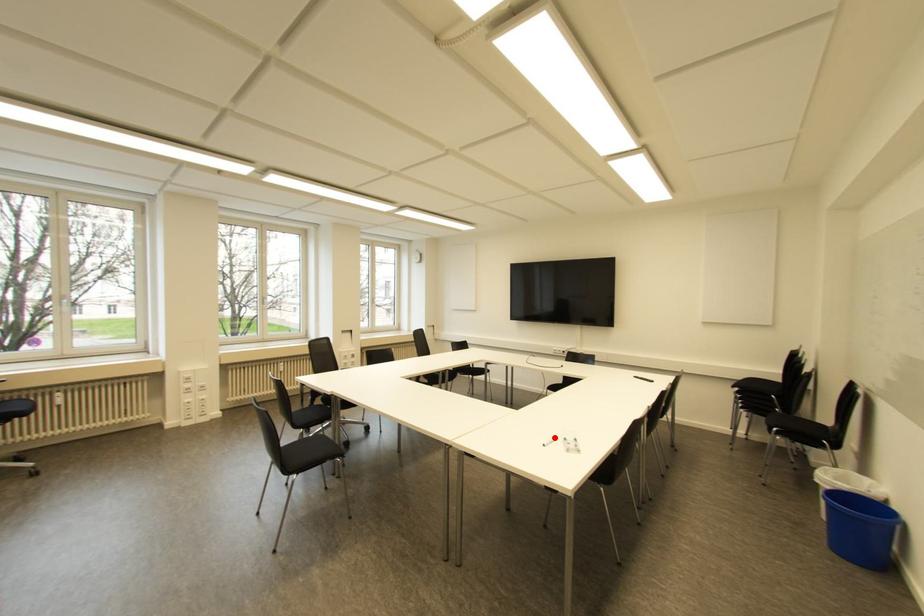
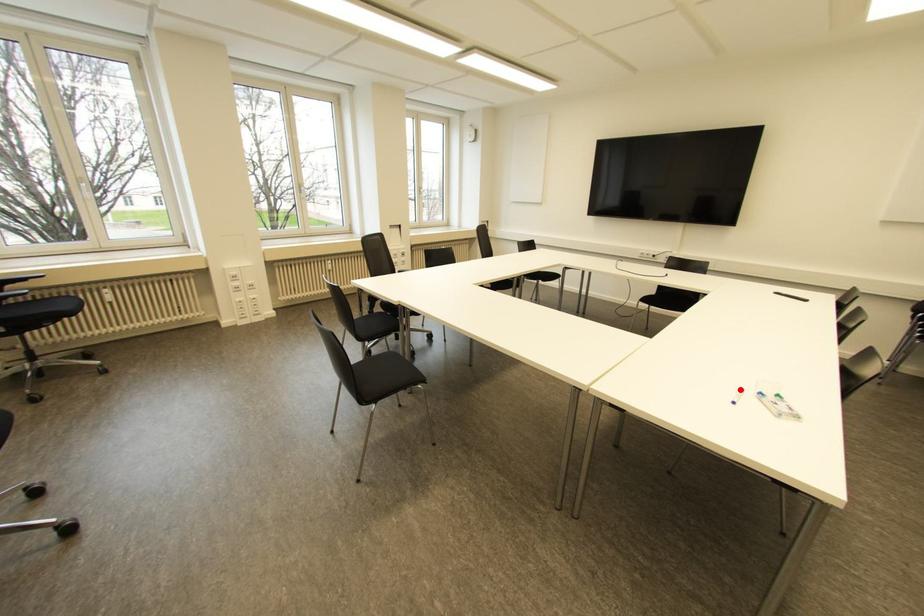
From the picture: I am providing you with two images of the same scene from different viewpoints. A red point is marked on the first image and another point is marked on the second image. Is the red point in image1 aligned with the point shown in image2?

Yes